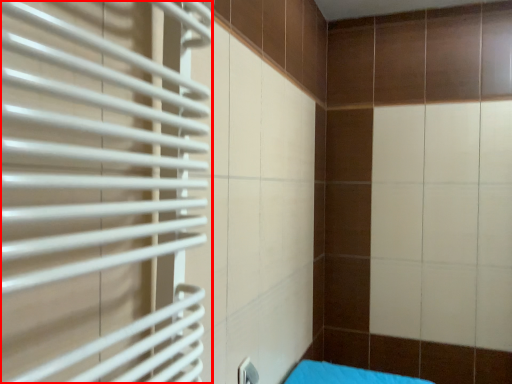
Question: From the image's perspective, what is the correct spatial relationship of shutter (annotated by the red box) in relation to furniture?

Choices:
 (A) above
 (B) below

Answer: (A)